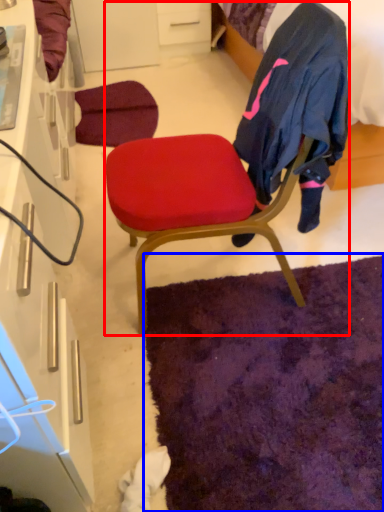
Question: Which object appears closest to the camera in this image, chair (highlighted by a red box) or mat (highlighted by a blue box)?

Choices:
 (A) chair
 (B) mat

Answer: (A)